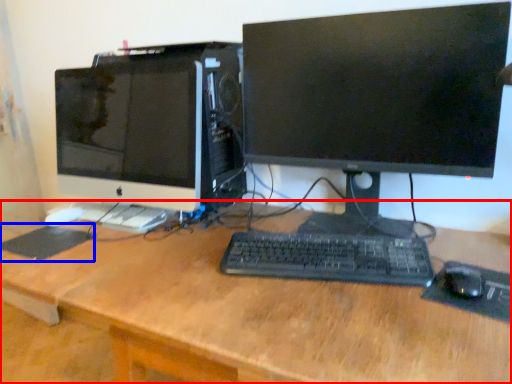
Question: Which of the following is the closest to the observer, desk (highlighted by a red box) or mousepad (highlighted by a blue box)?

Choices:
 (A) desk
 (B) mousepad

Answer: (A)